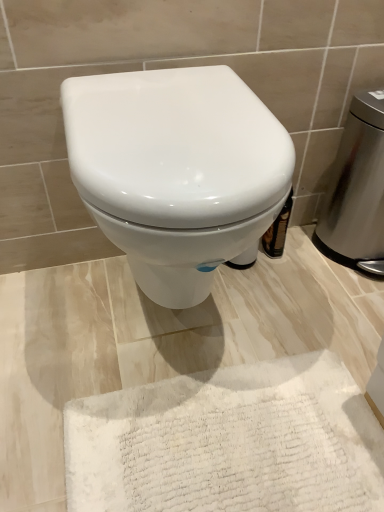
Question: Is white fluffy bath mat at lower center at the left side of stainless steel trash can at right?

Choices:
 (A) no
 (B) yes

Answer: (B)

Question: Is white fluffy bath mat at lower center thinner than stainless steel trash can at right?

Choices:
 (A) yes
 (B) no

Answer: (B)

Question: Is white fluffy bath mat at lower center oriented towards stainless steel trash can at right?

Choices:
 (A) yes
 (B) no

Answer: (B)

Question: From a real-world perspective, is white fluffy bath mat at lower center below stainless steel trash can at right?

Choices:
 (A) yes
 (B) no

Answer: (A)

Question: Can you confirm if white fluffy bath mat at lower center is positioned to the right of stainless steel trash can at right?

Choices:
 (A) no
 (B) yes

Answer: (A)

Question: From a real-world perspective, is white fluffy bath mat at lower center positioned over stainless steel trash can at right based on gravity?

Choices:
 (A) yes
 (B) no

Answer: (B)

Question: Is the depth of stainless steel trash can at right greater than that of white fluffy bath mat at lower center?

Choices:
 (A) no
 (B) yes

Answer: (B)

Question: Does stainless steel trash can at right have a larger size compared to white fluffy bath mat at lower center?

Choices:
 (A) no
 (B) yes

Answer: (B)

Question: Is stainless steel trash can at right not close to white fluffy bath mat at lower center?

Choices:
 (A) no
 (B) yes

Answer: (A)

Question: Is stainless steel trash can at right at the right side of white fluffy bath mat at lower center?

Choices:
 (A) yes
 (B) no

Answer: (A)

Question: From a real-world perspective, is stainless steel trash can at right beneath white fluffy bath mat at lower center?

Choices:
 (A) yes
 (B) no

Answer: (B)

Question: Can you confirm if stainless steel trash can at right is positioned to the left of white fluffy bath mat at lower center?

Choices:
 (A) yes
 (B) no

Answer: (B)

Question: Can you confirm if white fluffy bath mat at lower center is taller than white glossy toilet at center?

Choices:
 (A) no
 (B) yes

Answer: (A)